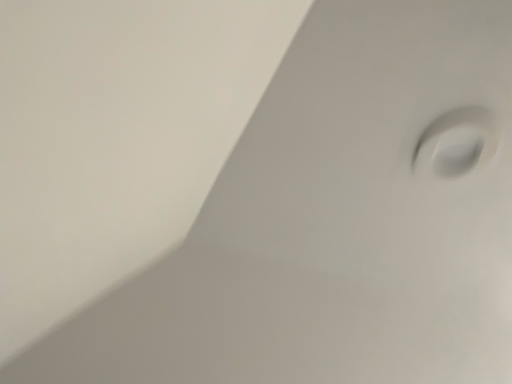
Find the location of a particular element. The image size is (512, 384). matte white hole at upper right is located at coordinates tap(456, 143).

This screenshot has width=512, height=384. Describe the element at coordinates (456, 143) in the screenshot. I see `matte white hole at upper right` at that location.

Image resolution: width=512 pixels, height=384 pixels. In order to click on matte white hole at upper right in this screenshot , I will do `click(456, 143)`.